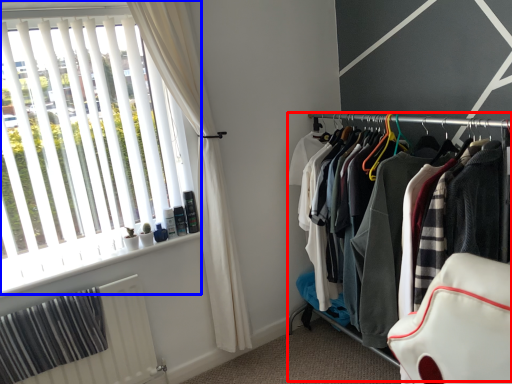
Question: Which point is closer to the camera, closet (highlighted by a red box) or window (highlighted by a blue box)?

Choices:
 (A) closet
 (B) window

Answer: (A)